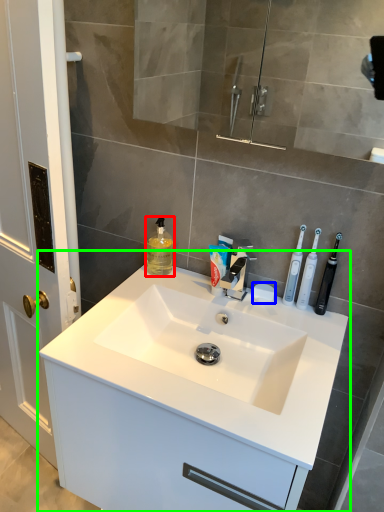
Question: Which object is the closest to the mouthwash (highlighted by a red box)? Choose among these: soap (highlighted by a blue box) or bathroom cabinet (highlighted by a green box).

Choices:
 (A) soap
 (B) bathroom cabinet

Answer: (A)